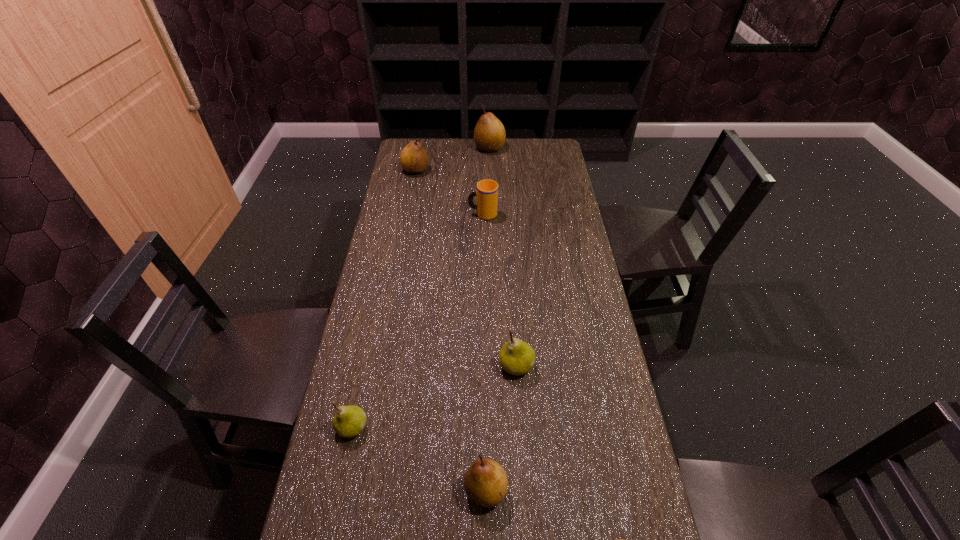
Locate which object ranks fifth in proximity to the second nearest brown pear. Please provide its 2D coordinates. Your answer should be formatted as a tuple, i.e. [(x, y)], where the tuple contains the x and y coordinates of a point satisfying the conditions above.

[(414, 159)]

Identify which pear is the second nearest to the smaller green pear. Please provide its 2D coordinates. Your answer should be formatted as a tuple, i.e. [(x, y)], where the tuple contains the x and y coordinates of a point satisfying the conditions above.

[(516, 357)]

Point out which pear is positioned as the second nearest to the sixth farthest object. Please provide its 2D coordinates. Your answer should be formatted as a tuple, i.e. [(x, y)], where the tuple contains the x and y coordinates of a point satisfying the conditions above.

[(516, 357)]

This screenshot has height=540, width=960. What are the coordinates of `brown pear that is the second closest to the biggest brown pear` in the screenshot? It's located at (486, 483).

Identify which brown pear is the second nearest to the third nearest brown pear. Please provide its 2D coordinates. Your answer should be formatted as a tuple, i.e. [(x, y)], where the tuple contains the x and y coordinates of a point satisfying the conditions above.

[(486, 483)]

This screenshot has width=960, height=540. I want to click on green pear that is the second closest to the second nearest pear, so click(x=349, y=421).

You are a GUI agent. You are given a task and a screenshot of the screen. Output one action in this format:
    pyautogui.click(x=<x>, y=<y>)
    Task: Click on the vacant area in the image that satisfies the following two spatial constraints: 1. on the back side of the smaller green pear; 2. on the side of the cup with the handle
    The height and width of the screenshot is (540, 960).
    Given the screenshot: What is the action you would take?
    pyautogui.click(x=397, y=214)